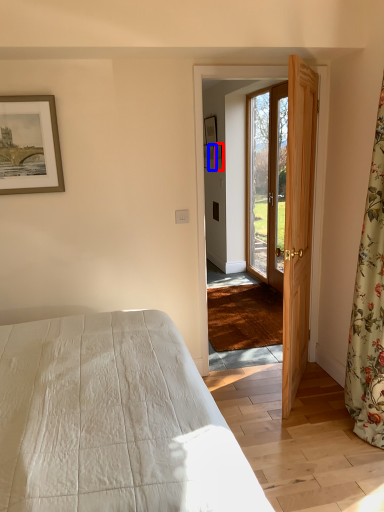
Question: Which object appears closest to the camera in this image, picture frame (highlighted by a red box) or picture frame (highlighted by a blue box)?

Choices:
 (A) picture frame
 (B) picture frame

Answer: (A)